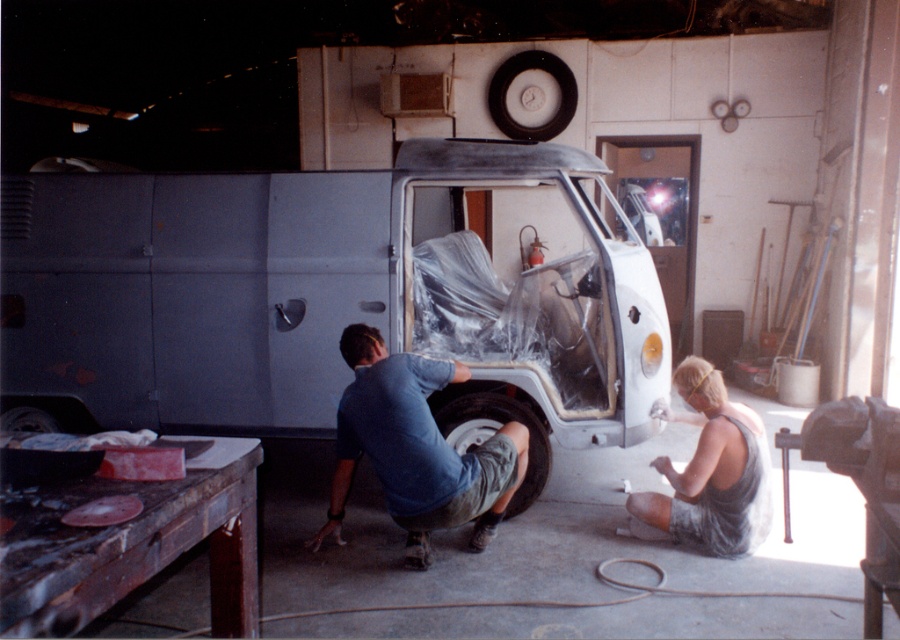
Between blue cotton shirt at lower center and gray fabric shirt at lower right, which one appears on the right side from the viewer's perspective?

Positioned to the right is gray fabric shirt at lower right.

Measure the distance between blue cotton shirt at lower center and gray fabric shirt at lower right.

blue cotton shirt at lower center is 3.76 feet from gray fabric shirt at lower right.

Describe the element at coordinates (416, 449) in the screenshot. The image size is (900, 640). I see `blue cotton shirt at lower center` at that location.

You are a GUI agent. You are given a task and a screenshot of the screen. Output one action in this format:
    pyautogui.click(x=<x>, y=<y>)
    Task: Click on the blue cotton shirt at lower center
    The width and height of the screenshot is (900, 640).
    Given the screenshot: What is the action you would take?
    coord(416,449)

Does metallic silver van at center have a smaller size compared to gray fabric shirt at lower right?

Actually, metallic silver van at center might be larger than gray fabric shirt at lower right.

Is point (556, 280) farther from camera compared to point (700, 464)?

Yes, point (556, 280) is farther from viewer.

Identify the location of metallic silver van at center. (327, 298).

What do you see at coordinates (327, 298) in the screenshot? I see `metallic silver van at center` at bounding box center [327, 298].

Does metallic silver van at center have a greater height compared to black rubber tire at lower center?

Correct, metallic silver van at center is much taller as black rubber tire at lower center.

The image size is (900, 640). Identify the location of metallic silver van at center. (327, 298).